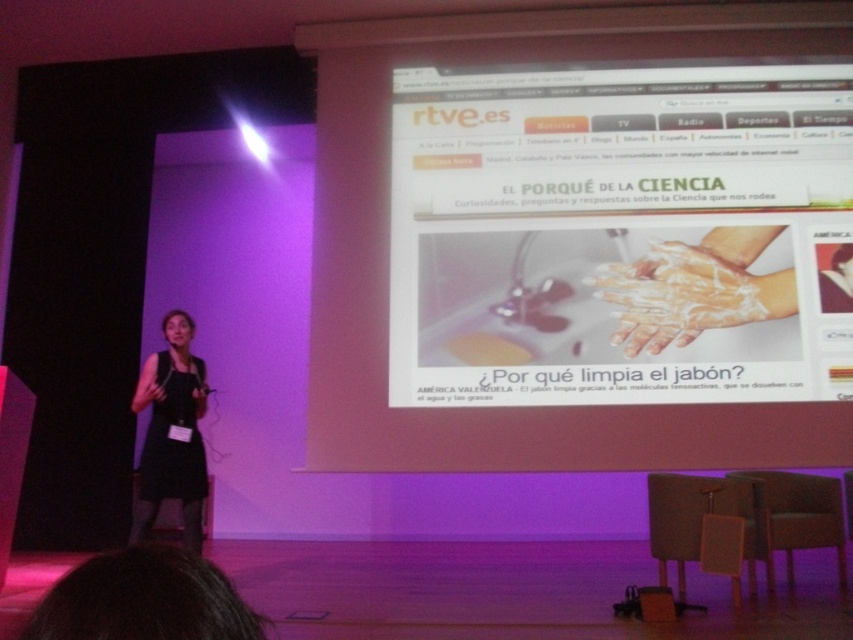
Question: Can you confirm if white glossy webpage at upper center is bigger than white foamy hands at center?

Choices:
 (A) no
 (B) yes

Answer: (B)

Question: Which is nearer to the white foamy hands at center?

Choices:
 (A) black fabric dress at lower left
 (B) white glossy webpage at upper center

Answer: (B)

Question: Does white foamy hands at center have a larger size compared to black fabric dress at lower left?

Choices:
 (A) yes
 (B) no

Answer: (B)

Question: Observing the image, what is the correct spatial positioning of white glossy webpage at upper center in reference to white foamy hands at center?

Choices:
 (A) left
 (B) right

Answer: (A)

Question: Considering the real-world distances, which object is closest to the black fabric dress at lower left?

Choices:
 (A) white foamy hands at center
 (B) white glossy webpage at upper center

Answer: (B)

Question: Which point is farther to the camera?

Choices:
 (A) black fabric dress at lower left
 (B) white glossy webpage at upper center

Answer: (B)